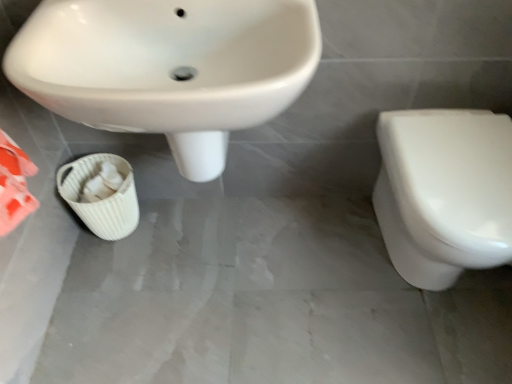
Image resolution: width=512 pixels, height=384 pixels. In order to click on vacant area that lies between white glossy toilet at right and white woven basket at lower left in this screenshot , I will do `click(263, 246)`.